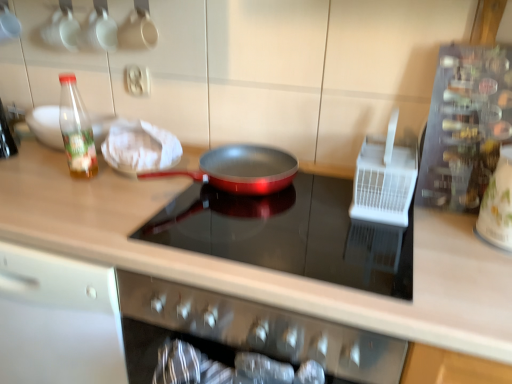
The width and height of the screenshot is (512, 384). Identify the location of vacant region to the right of transparent plastic bottle at left. (139, 190).